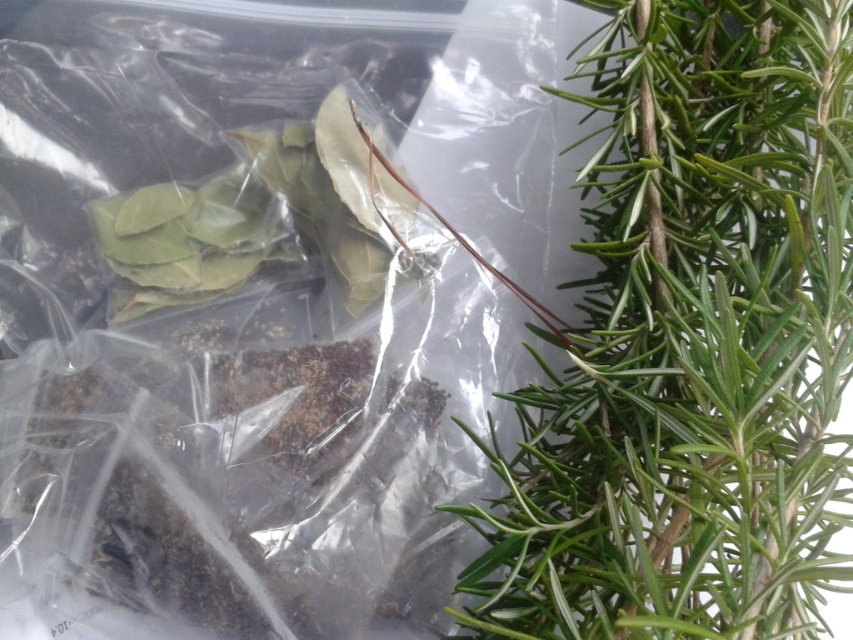
Question: Does transparent plastic bag at upper right appear under green needle-like leaves at upper right?

Choices:
 (A) yes
 (B) no

Answer: (B)

Question: Among these points, which one is farthest from the camera?

Choices:
 (A) (648, 221)
 (B) (463, 408)

Answer: (B)

Question: Which of the following is the farthest from the observer?

Choices:
 (A) (840, 160)
 (B) (485, 109)

Answer: (B)

Question: Does transparent plastic bag at upper right lie in front of green needle-like leaves at upper right?

Choices:
 (A) no
 (B) yes

Answer: (A)

Question: Does transparent plastic bag at upper right come in front of green needle-like leaves at upper right?

Choices:
 (A) yes
 (B) no

Answer: (B)

Question: Which point appears closest to the camera in this image?

Choices:
 (A) (793, 474)
 (B) (36, 492)

Answer: (A)